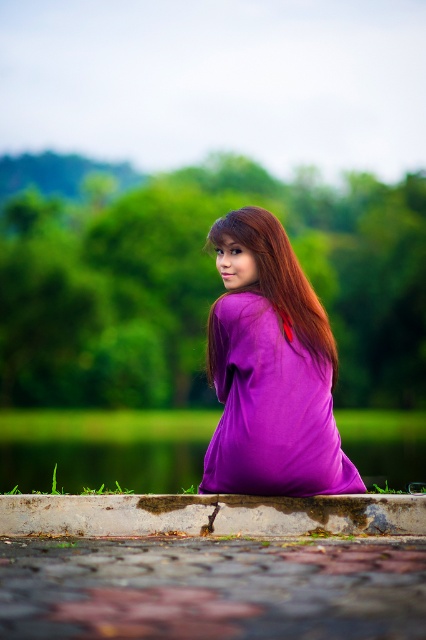
Does purple matte dress at center appear over concrete curb at lower center?

Indeed, purple matte dress at center is positioned over concrete curb at lower center.

Is purple matte dress at center closer to camera compared to concrete curb at lower center?

No, it is behind concrete curb at lower center.

Does point (281, 336) come in front of point (97, 509)?

No, (281, 336) is behind (97, 509).

This screenshot has height=640, width=426. What are the coordinates of `purple matte dress at center` in the screenshot? It's located at (271, 372).